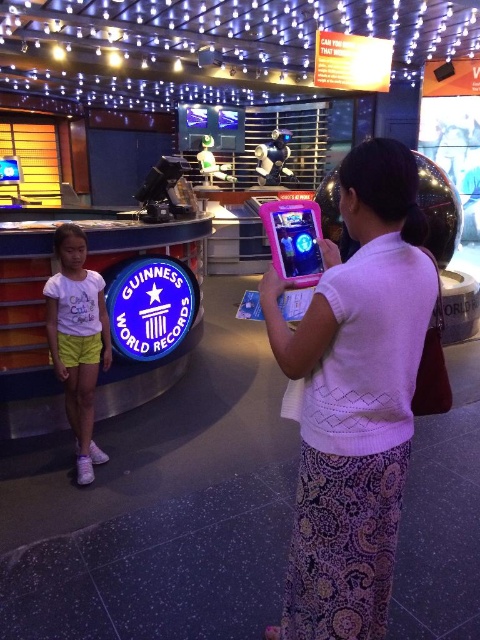
Question: Is white matte shirt at left further to the viewer compared to pink plastic tablet at center?

Choices:
 (A) yes
 (B) no

Answer: (A)

Question: Observing the image, what is the correct spatial positioning of pink fabric tablet at center in reference to pink plastic tablet at center?

Choices:
 (A) below
 (B) above

Answer: (A)

Question: Which of the following is the closest to the observer?

Choices:
 (A) white matte shirt at left
 (B) pink fabric tablet at center
 (C) pink plastic tablet at center

Answer: (B)

Question: Which of the following is the closest to the observer?

Choices:
 (A) (301, 284)
 (B) (336, 353)
 (C) (50, 349)

Answer: (B)

Question: Is pink fabric tablet at center to the left of white matte shirt at left from the viewer's perspective?

Choices:
 (A) no
 (B) yes

Answer: (A)

Question: Estimate the real-world distances between objects in this image. Which object is closer to the pink plastic tablet at center?

Choices:
 (A) pink fabric tablet at center
 (B) white matte shirt at left

Answer: (A)